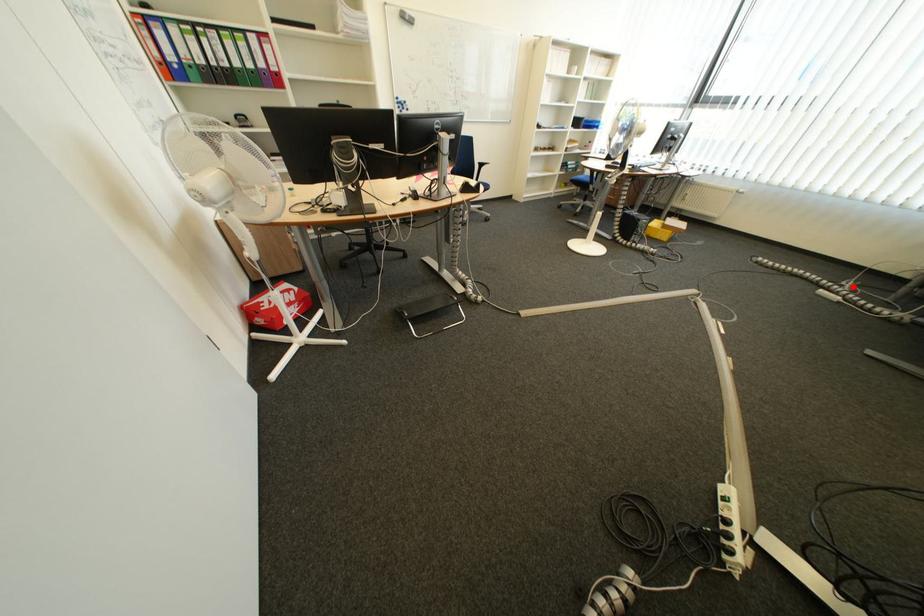
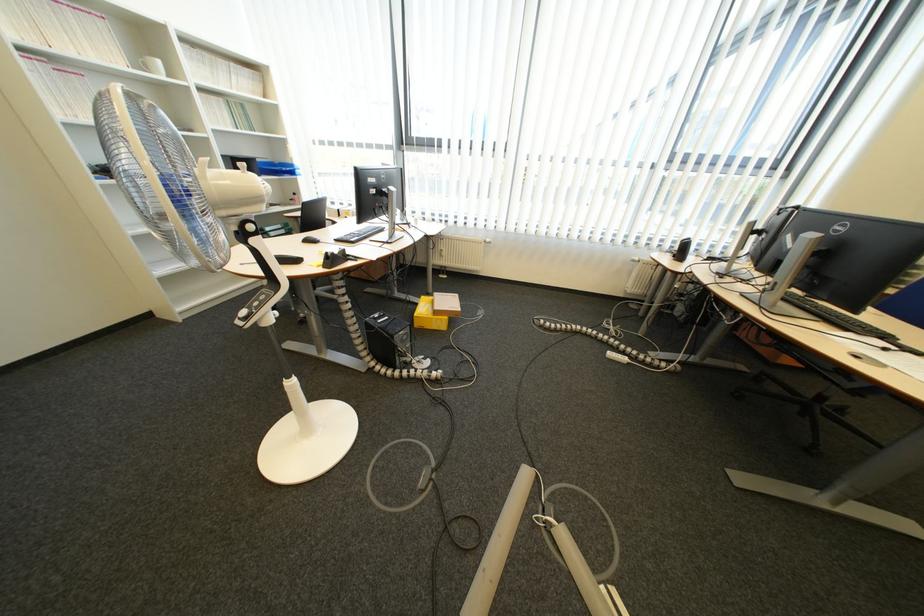
Find the pixel in the second image that matches the highlighted location in the first image.

(619, 331)